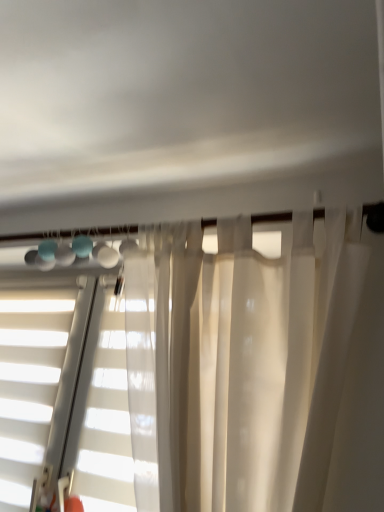
Where is `translucent white blinds at center`? The height and width of the screenshot is (512, 384). translucent white blinds at center is located at coordinates (71, 374).

What do you see at coordinates (71, 374) in the screenshot? Image resolution: width=384 pixels, height=512 pixels. I see `translucent white blinds at center` at bounding box center [71, 374].

Measure the distance between point (1,483) and camera.

Point (1,483) and camera are 1.40 meters apart from each other.

Locate an element on the screen. Image resolution: width=384 pixels, height=512 pixels. white matte blinds at left is located at coordinates (29, 383).

What do you see at coordinates (29, 383) in the screenshot?
I see `white matte blinds at left` at bounding box center [29, 383].

You are a GUI agent. You are given a task and a screenshot of the screen. Output one action in this format:
    pyautogui.click(x=<x>, y=<y>)
    Task: Click on the translucent white blinds at center
    The height and width of the screenshot is (512, 384).
    Given the screenshot: What is the action you would take?
    pyautogui.click(x=71, y=374)

Based on their positions, is white matte blinds at left located to the left or right of translucent white blinds at center?

white matte blinds at left is to the left of translucent white blinds at center.

Does white matte blinds at left lie in front of translucent white blinds at center?

No, white matte blinds at left is behind translucent white blinds at center.

Does point (58, 335) lie behind point (90, 360)?

Yes, it is behind point (90, 360).

From the image's perspective, which one is positioned higher, white matte blinds at left or translucent white blinds at center?

translucent white blinds at center.

From a real-world perspective, is white matte blinds at left over translucent white blinds at center?

Incorrect, from a real-world perspective, white matte blinds at left is lower than translucent white blinds at center.

Considering the sizes of white matte blinds at left and translucent white blinds at center in the image, is white matte blinds at left wider or thinner than translucent white blinds at center?

Considering their sizes, white matte blinds at left looks broader than translucent white blinds at center.

Does white matte blinds at left have a greater height compared to translucent white blinds at center?

Correct, white matte blinds at left is much taller as translucent white blinds at center.

Can you confirm if white matte blinds at left is bigger than translucent white blinds at center?

Indeed, white matte blinds at left has a larger size compared to translucent white blinds at center.

Does white matte blinds at left contain translucent white blinds at center?

No, white matte blinds at left does not contain translucent white blinds at center.

Based on the photo, is there a large distance between white matte blinds at left and translucent white blinds at center?

white matte blinds at left is near translucent white blinds at center, not far away.

Is white matte blinds at left oriented away from translucent white blinds at center?

No, white matte blinds at left is not facing away from translucent white blinds at center.

Locate an element on the screen. bay window lying above the white matte blinds at left (from the image's perspective) is located at coordinates (71, 374).

Does translucent white blinds at center appear on the left side of white matte blinds at left?

Incorrect, translucent white blinds at center is not on the left side of white matte blinds at left.

Is translucent white blinds at center in front of or behind white matte blinds at left in the image?

In the image, translucent white blinds at center appears in front of white matte blinds at left.

Between point (90, 499) and point (26, 298), which one is positioned behind?

Positioned behind is point (26, 298).

From the image's perspective, between translucent white blinds at center and white matte blinds at left, who is located below?

white matte blinds at left appears lower in the image.

From a real-world perspective, which object rests below the other?

From a 3D spatial view, white matte blinds at left is below.

Looking at this image, is translucent white blinds at center wider or thinner than white matte blinds at left?

translucent white blinds at center is thinner than white matte blinds at left.

Can you confirm if translucent white blinds at center is taller than white matte blinds at left?

In fact, translucent white blinds at center may be shorter than white matte blinds at left.

Does translucent white blinds at center have a larger size compared to white matte blinds at left?

No, translucent white blinds at center is not bigger than white matte blinds at left.

In the scene shown: Is white matte blinds at left located within translucent white blinds at center?

Definitely not — white matte blinds at left is not inside translucent white blinds at center.

Is translucent white blinds at center next to white matte blinds at left?

Yes, translucent white blinds at center and white matte blinds at left clearly make contact.

Does translucent white blinds at center turn towards white matte blinds at left?

No, translucent white blinds at center is not turned towards white matte blinds at left.

Can you tell me how much translucent white blinds at center and white matte blinds at left differ in facing direction?

The facing directions of translucent white blinds at center and white matte blinds at left are 0.00199 degrees apart.

You are a GUI agent. You are given a task and a screenshot of the screen. Output one action in this format:
    pyautogui.click(x=<x>, y=<y>)
    Task: Click on the bay window lying on the right of white matte blinds at left
    
    Given the screenshot: What is the action you would take?
    pyautogui.click(x=71, y=374)

This screenshot has height=512, width=384. In the image, there is a translucent white blinds at center. Find the location of `window below it (from a real-world perspective)`. window below it (from a real-world perspective) is located at coordinates tap(29, 383).

You are a GUI agent. You are given a task and a screenshot of the screen. Output one action in this format:
    pyautogui.click(x=<x>, y=<y>)
    Task: Click on the bay window above the white matte blinds at left (from the image's perspective)
    The height and width of the screenshot is (512, 384).
    Given the screenshot: What is the action you would take?
    pyautogui.click(x=71, y=374)